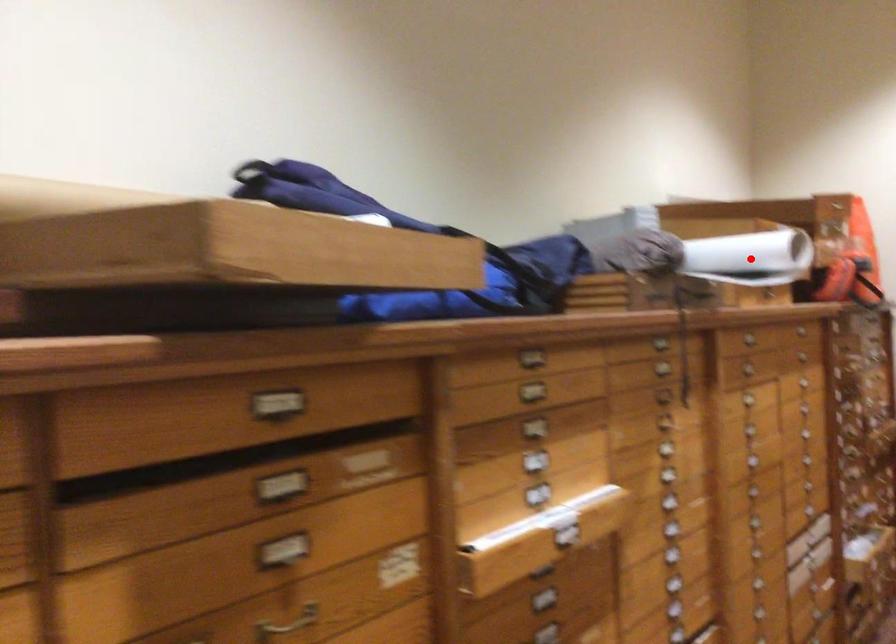
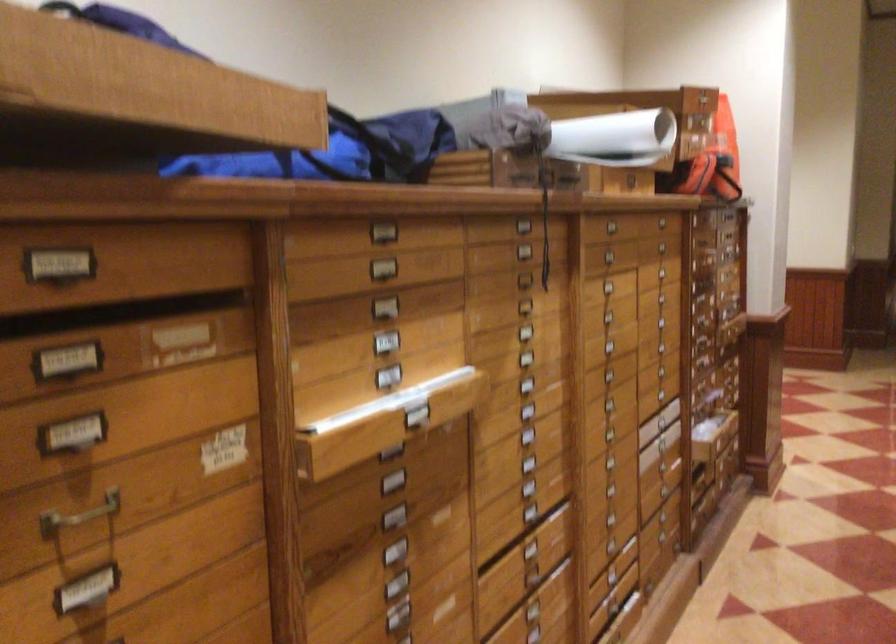
Find the pixel in the second image that matches the highlighted location in the first image.

(615, 138)